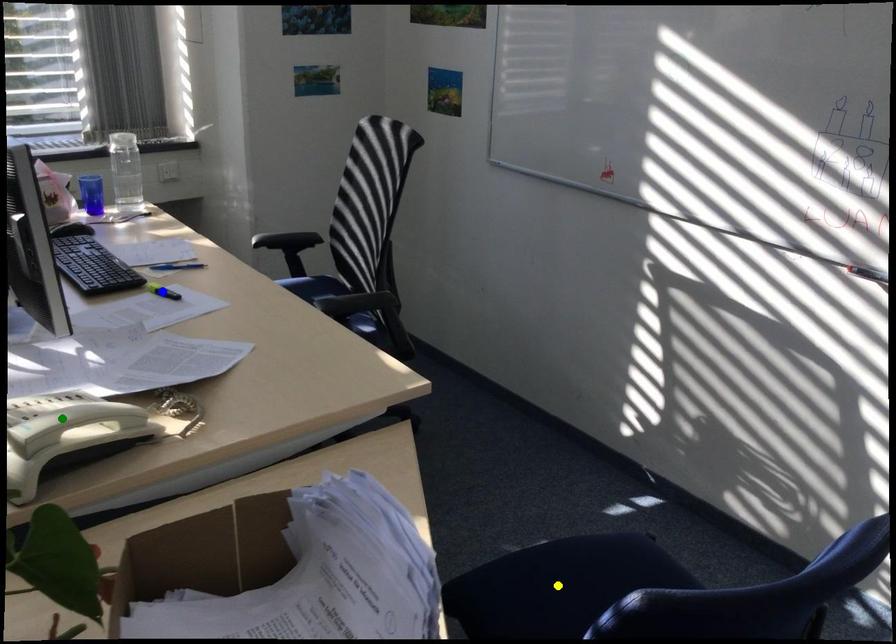
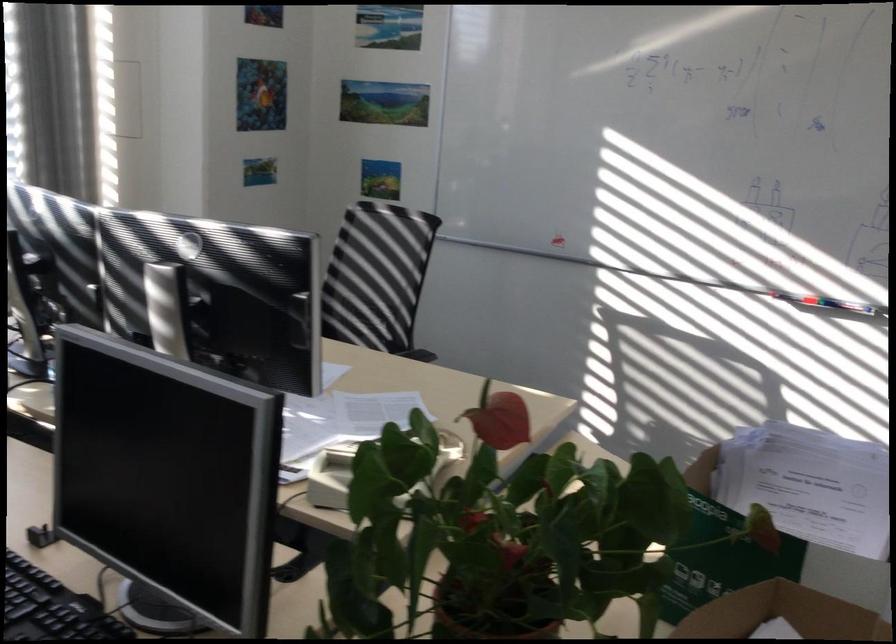
I am providing you with two images of the same scene from different viewpoints. Three points are marked in image1. Which point corresponds to a part or object that is occluded in image2?In image1, three points are marked. Which of them correspond to a part or object that is occluded in image2?Among the three points shown in image1, which one corresponds to a part or object that is no longer visible due to occlusion in image2?

Invisible in image2: yellow point, green point, blue point.